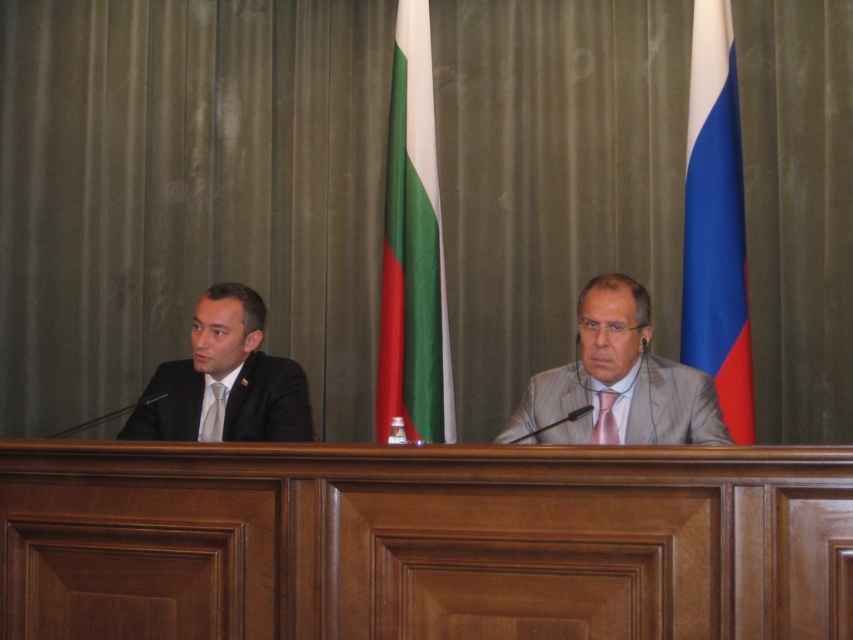
Does green fabric flag at center appear on the left side of matte black suit at left?

Incorrect, green fabric flag at center is not on the left side of matte black suit at left.

Which of these two, green fabric flag at center or matte black suit at left, stands taller?

Standing taller between the two is green fabric flag at center.

Does point (407, 144) come behind point (126, 435)?

That is True.

The width and height of the screenshot is (853, 640). I want to click on green fabric flag at center, so [413, 250].

Is green fabric flag at center further to camera compared to blue fabric flag at right?

Yes.

Does green fabric flag at center have a lesser width compared to blue fabric flag at right?

No, green fabric flag at center is not thinner than blue fabric flag at right.

Locate an element on the screen. The width and height of the screenshot is (853, 640). green fabric flag at center is located at coordinates (413, 250).

Find the location of a particular element. green fabric flag at center is located at coordinates (413, 250).

Can you confirm if blue fabric flag at right is bigger than matte black suit at left?

No, blue fabric flag at right is not bigger than matte black suit at left.

Which is more to the right, blue fabric flag at right or matte black suit at left?

blue fabric flag at right is more to the right.

Does point (717, 166) come behind point (288, 394)?

Yes, point (717, 166) is farther from viewer.

This screenshot has height=640, width=853. In order to click on blue fabric flag at right in this screenshot , I will do `click(717, 221)`.